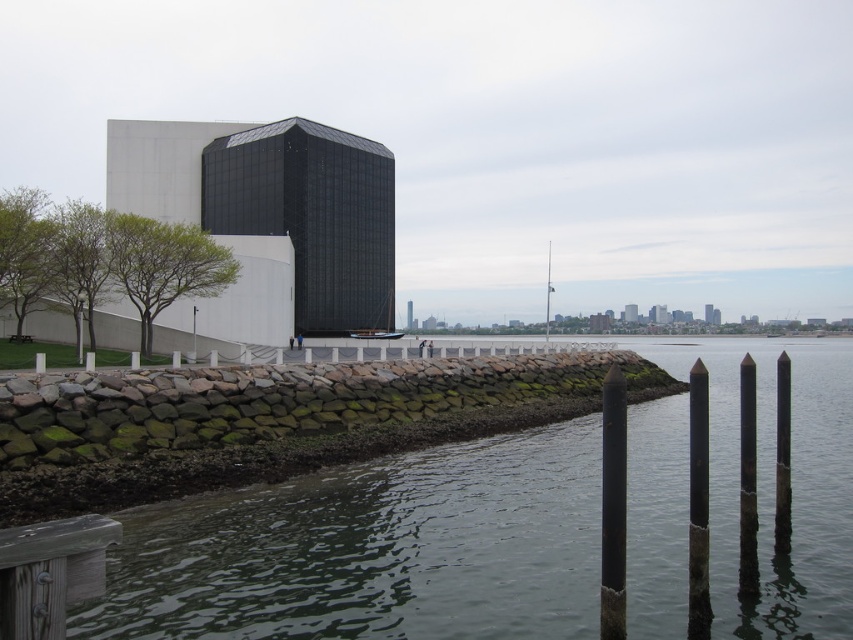
Question: Is green stone wall at lower left positioned behind wooden dock at lower left?

Choices:
 (A) no
 (B) yes

Answer: (B)

Question: Is black matte pole at lower right to the right of black matte pole at center from the viewer's perspective?

Choices:
 (A) no
 (B) yes

Answer: (A)

Question: Which of the following is the closest to the observer?

Choices:
 (A) (50, 557)
 (B) (602, 611)
 (C) (462, 593)

Answer: (A)

Question: Does green stone wall at lower left appear on the right side of black matte pole at lower right?

Choices:
 (A) yes
 (B) no

Answer: (A)

Question: Which of the following is the closest to the observer?

Choices:
 (A) (51, 596)
 (B) (431, 509)
 (C) (614, 513)

Answer: (A)

Question: Which of the following is the farthest from the observer?

Choices:
 (A) black matte pole at center
 (B) wooden dock at lower left

Answer: (A)